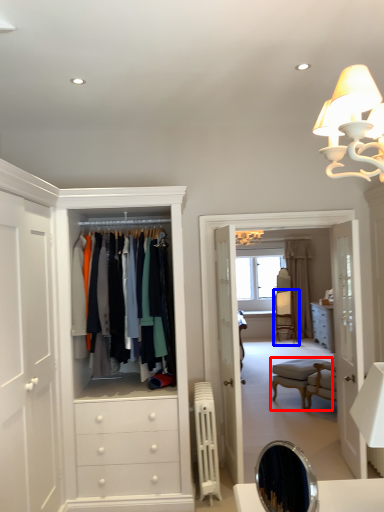
Question: Which object is further to the camera taking this photo, vanity (highlighted by a red box) or armchair (highlighted by a blue box)?

Choices:
 (A) vanity
 (B) armchair

Answer: (B)